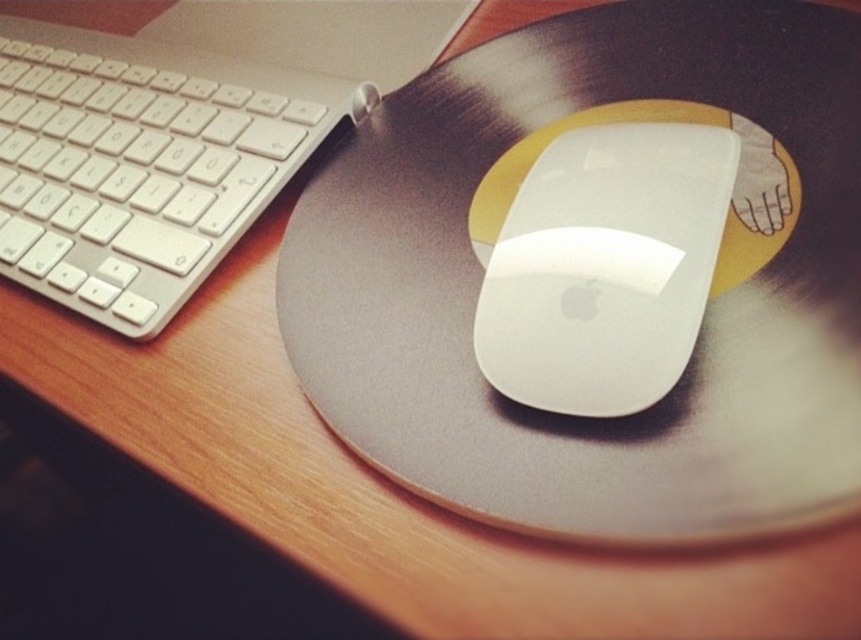
Question: In this image, where is white plastic keyboard at left located relative to white glossy mouse at center?

Choices:
 (A) left
 (B) right

Answer: (A)

Question: Which of the following is the closest to the observer?

Choices:
 (A) white plastic keyboard at left
 (B) white glossy mouse at center

Answer: (B)

Question: Is white plastic keyboard at left closer to camera compared to white glossy mouse at center?

Choices:
 (A) no
 (B) yes

Answer: (A)

Question: Does white plastic keyboard at left appear on the right side of white glossy mouse at center?

Choices:
 (A) yes
 (B) no

Answer: (B)

Question: Which object appears farthest from the camera in this image?

Choices:
 (A) white plastic keyboard at left
 (B) white glossy mouse at center

Answer: (A)

Question: Which object appears farthest from the camera in this image?

Choices:
 (A) white plastic keyboard at left
 (B) white glossy mouse at center

Answer: (A)